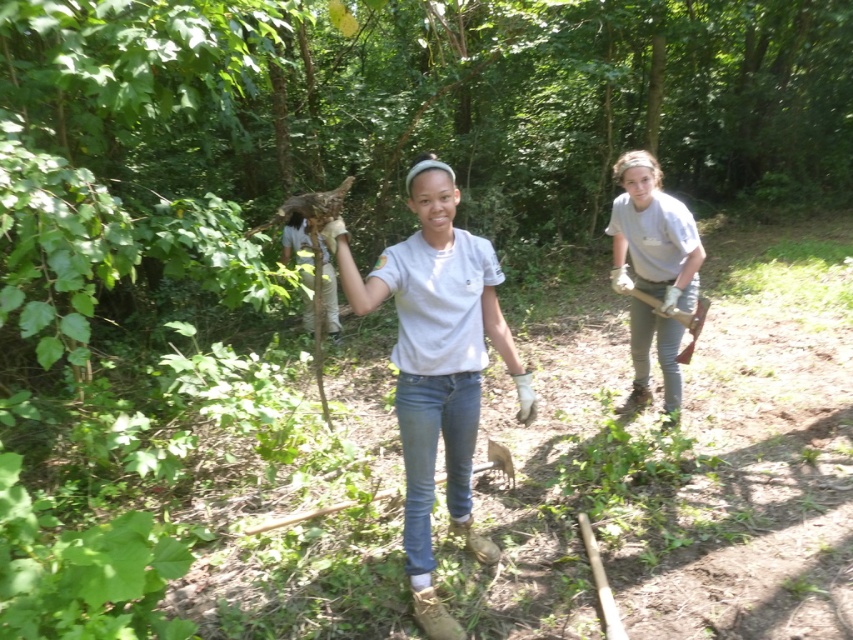
Which of these two, white cotton shirt at center or wooden shovel at right, stands shorter?

wooden shovel at right

Describe the element at coordinates (437, 364) in the screenshot. I see `white cotton shirt at center` at that location.

Locate an element on the screen. white cotton shirt at center is located at coordinates (437, 364).

Does white cotton shirt at center have a larger size compared to gray matte shirt at right?

Yes.

At what (x,y) coordinates should I click in order to perform the action: click on white cotton shirt at center. Please return your answer as a coordinate pair (x, y). This screenshot has width=853, height=640. Looking at the image, I should click on (437, 364).

Is point (428, 609) more distant than point (670, 344)?

No.

At what (x,y) coordinates should I click in order to perform the action: click on white cotton shirt at center. Please return your answer as a coordinate pair (x, y). Looking at the image, I should click on (437, 364).

Between point (634, 284) and point (699, 298), which one is positioned in front?

Point (699, 298) is more forward.

How distant is gray matte shirt at right from wooden shovel at right?

gray matte shirt at right and wooden shovel at right are 7.74 inches apart from each other.

Identify the location of gray matte shirt at right. The image size is (853, 640). (653, 269).

This screenshot has width=853, height=640. In order to click on gray matte shirt at right in this screenshot , I will do `click(653, 269)`.